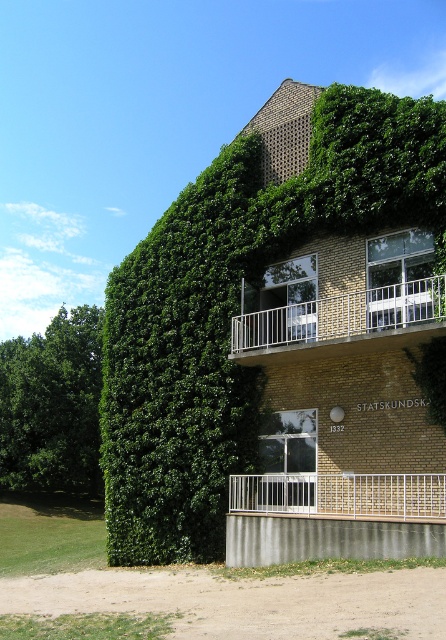
Does green leafy tree at center have a greater width compared to green leafy tree at left?

Incorrect, green leafy tree at center's width does not surpass green leafy tree at left's.

Who is positioned more to the left, green leafy tree at center or green leafy tree at left?

Positioned to the left is green leafy tree at left.

Which is in front, point (135, 307) or point (60, 337)?

Positioned in front is point (135, 307).

This screenshot has width=446, height=640. What are the coordinates of `green leafy tree at center` in the screenshot? It's located at coord(289,332).

You are a GUI agent. You are given a task and a screenshot of the screen. Output one action in this format:
    pyautogui.click(x=<x>, y=<y>)
    Task: Click on the green leafy tree at left
    The height and width of the screenshot is (640, 446).
    Given the screenshot: What is the action you would take?
    pyautogui.click(x=53, y=404)

Does green leafy tree at left appear under white metal balcony at upper center?

Yes, green leafy tree at left is below white metal balcony at upper center.

Who is more distant from viewer, (37, 476) or (285, 352)?

The point (37, 476) is behind.

I want to click on green leafy tree at left, so click(x=53, y=404).

Is green leafy tree at center smaller than white metal balcony at center?

No, green leafy tree at center is not smaller than white metal balcony at center.

Between point (343, 138) and point (283, 486), which one is positioned in front?

Positioned in front is point (283, 486).

What are the coordinates of `green leafy tree at center` in the screenshot? It's located at (289, 332).